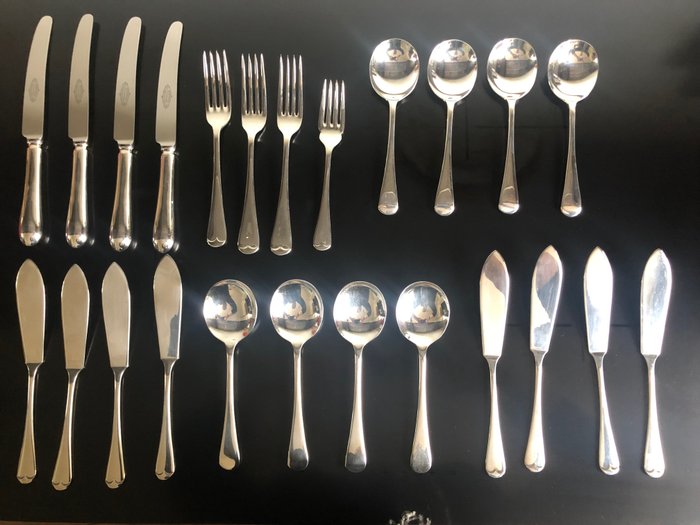
This screenshot has width=700, height=525. I want to click on knives, so click(35, 125), click(77, 119), click(124, 119), click(164, 112).